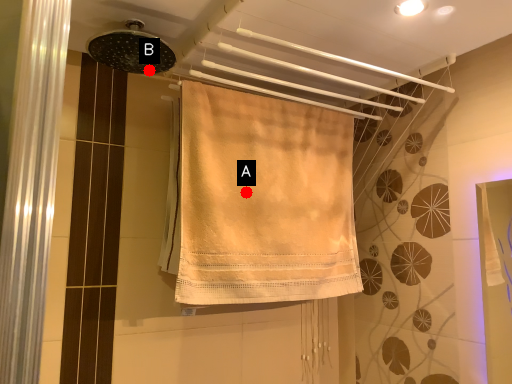
Question: Two points are circled on the image, labeled by A and B beside each circle. Which point is closer to the camera?

Choices:
 (A) A is closer
 (B) B is closer

Answer: (B)